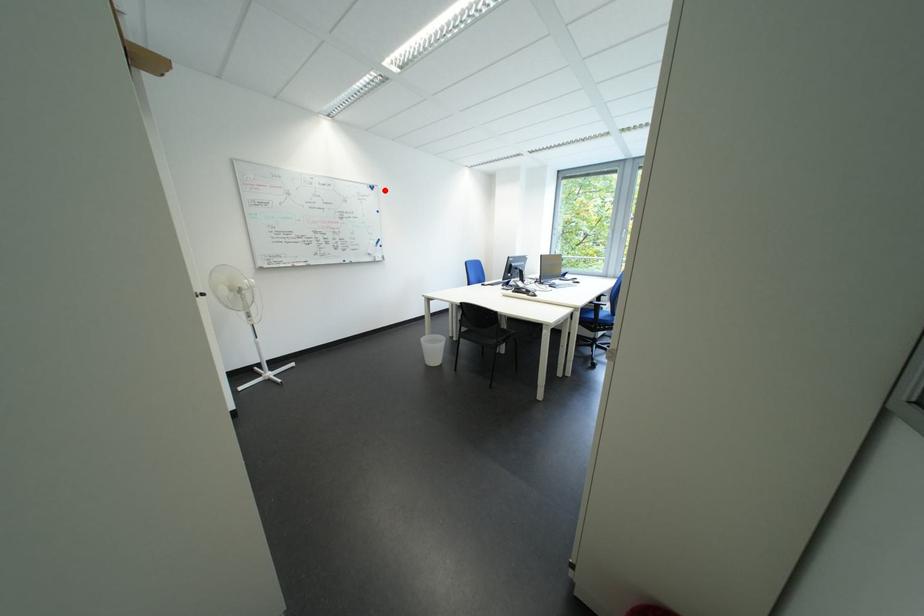
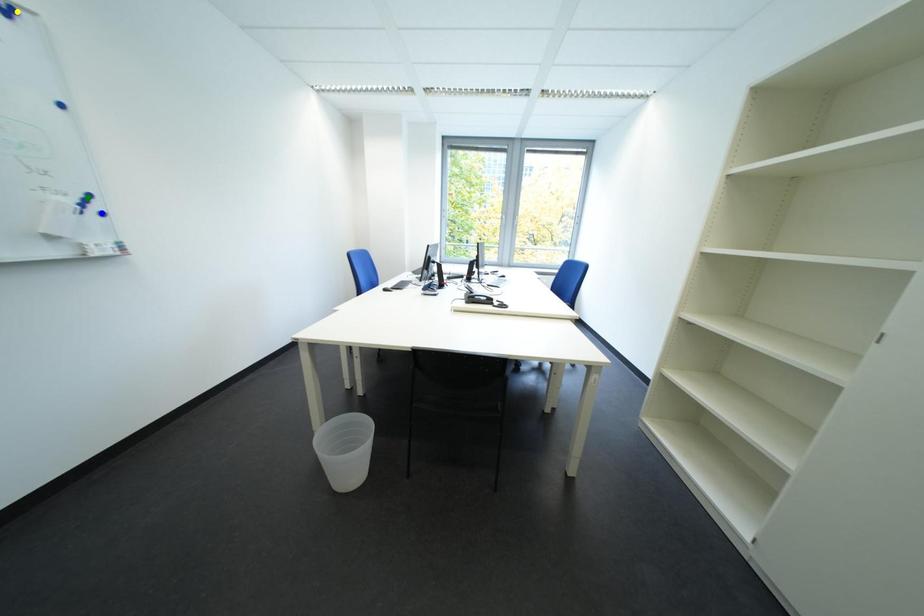
Question: I am providing you with two images of the same scene from different viewpoints. A red point is marked on the first image. You are given multiple points on the second image. Which point in image 2 is actually the same real-world point as the red point in image 1?

Choices:
 (A) green point
 (B) yellow point
 (C) blue point

Answer: (B)